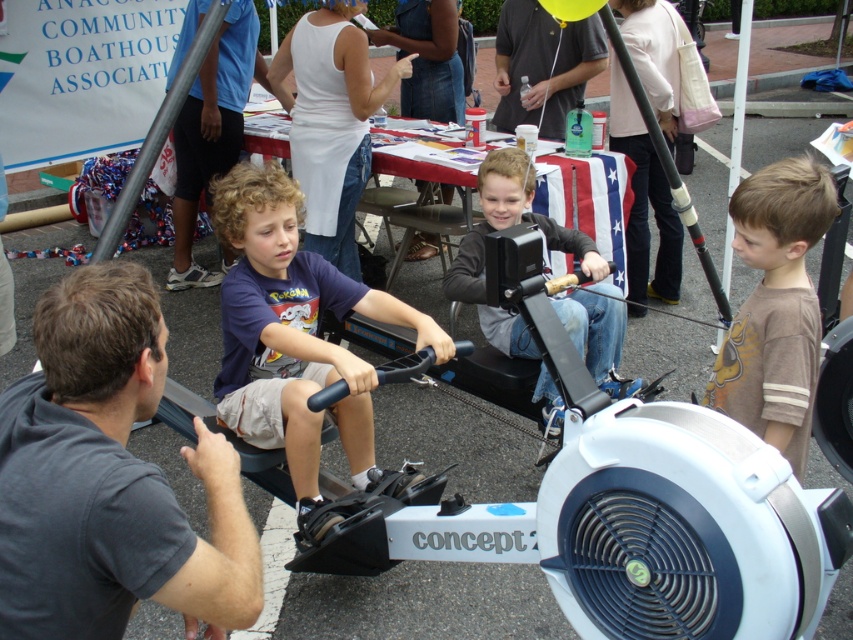
You are a photographer at the community event and want to take a photo of both the dark gray shirt at center and the dark gray shirt at upper center. The minimum distance between them for the photo to capture both clearly is 3 meters. Can you capture both in one shot?

The dark gray shirt at center is 3.56 meters from the dark gray shirt at upper center. Since 3.56 meters is greater than the required 3 meters minimum distance, the photographer can capture both in one shot as they are within the acceptable range.